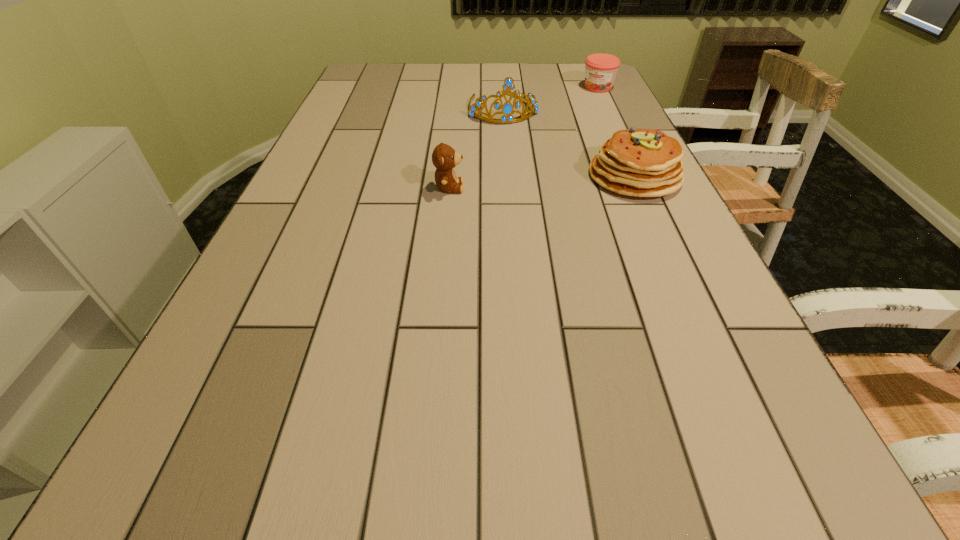
Identify the location of free area in between the tiara and the shortest object. The image size is (960, 540). (550, 98).

At what (x,y) coordinates should I click in order to perform the action: click on vacant point located between the jam and the pancake. Please return your answer as a coordinate pair (x, y). The height and width of the screenshot is (540, 960). Looking at the image, I should click on (616, 132).

This screenshot has height=540, width=960. Identify the location of object that can be found as the closest to the pancake. (507, 108).

Find the location of a particular element. Image resolution: width=960 pixels, height=540 pixels. object that stands as the second closest to the pancake is located at coordinates (444, 158).

Where is `vacant position in the image that satisfies the following two spatial constraints: 1. on the front side of the pancake; 2. on the right side of the tiara`? vacant position in the image that satisfies the following two spatial constraints: 1. on the front side of the pancake; 2. on the right side of the tiara is located at coordinates (509, 176).